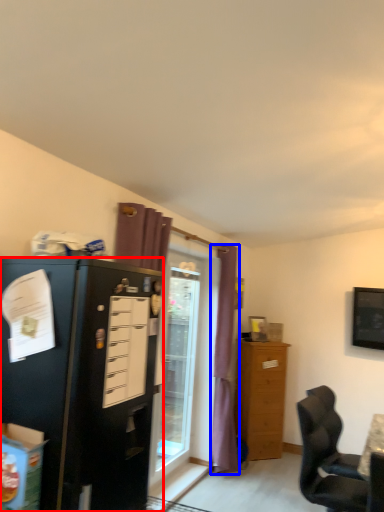
Question: Among these objects, which one is nearest to the camera, cabinetry (highlighted by a red box) or curtain (highlighted by a blue box)?

Choices:
 (A) cabinetry
 (B) curtain

Answer: (A)